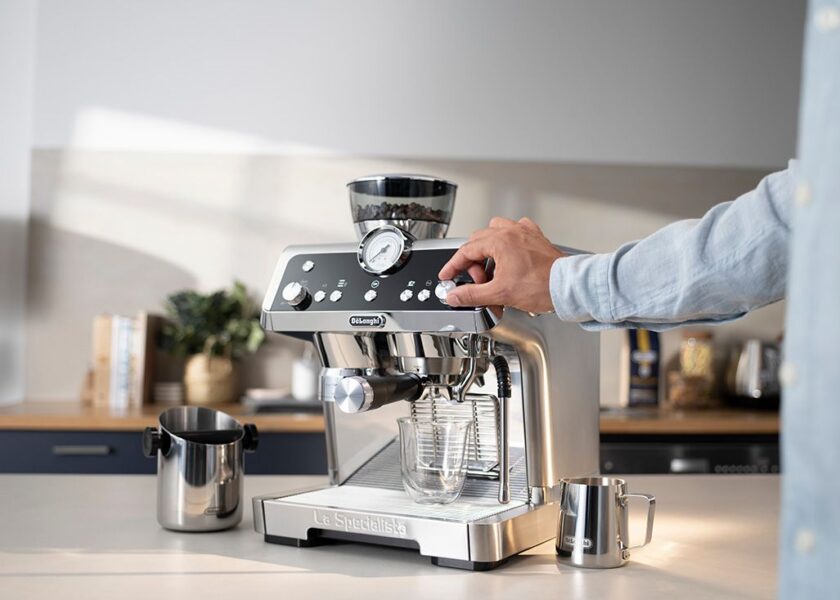
This screenshot has height=600, width=840. In order to click on electric kettle in this screenshot , I will do `click(752, 374)`.